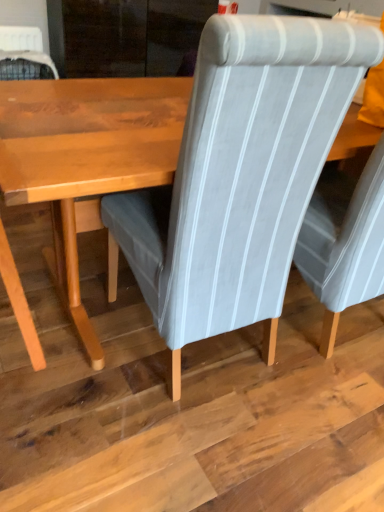
Locate an element on the screen. The height and width of the screenshot is (512, 384). empty space that is to the right of light gray fabric chair at center is located at coordinates (323, 403).